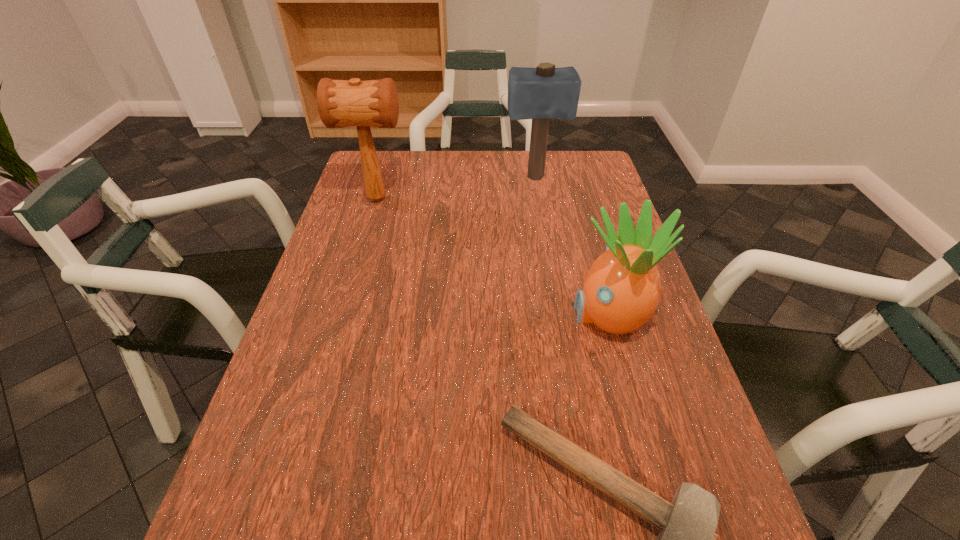
The width and height of the screenshot is (960, 540). I want to click on the leftmost object, so coord(341,103).

Where is `the second nearest object`? Image resolution: width=960 pixels, height=540 pixels. the second nearest object is located at coordinates (622, 289).

You are a GUI agent. You are given a task and a screenshot of the screen. Output one action in this format:
    pyautogui.click(x=<x>, y=<y>)
    Task: Click on the third tallest object
    The height and width of the screenshot is (540, 960).
    Given the screenshot: What is the action you would take?
    pyautogui.click(x=622, y=289)

You are a GUI agent. You are given a task and a screenshot of the screen. Output one action in this format:
    pyautogui.click(x=<x>, y=<y>)
    Task: Click on the free space located on the strike surface of the leftmost mallet
    The width and height of the screenshot is (960, 540).
    Given the screenshot: What is the action you would take?
    pyautogui.click(x=426, y=199)

I want to click on free space located at the entrance of the third tallest object, so click(473, 314).

Find the location of a particular element. free region located 0.070m at the entrance of the third tallest object is located at coordinates (539, 314).

At what (x,y) coordinates should I click in order to perform the action: click on free space located 0.160m at the entrance of the third tallest object. Please return your answer as a coordinate pair (x, y). This screenshot has height=540, width=960. Looking at the image, I should click on (499, 314).

Find the location of `object situated at the left edge`. object situated at the left edge is located at coordinates 341,103.

Identify the location of mallet that is at the right edge. Image resolution: width=960 pixels, height=540 pixels. (544, 92).

You are a GUI agent. You are given a task and a screenshot of the screen. Output one action in this format:
    pyautogui.click(x=<x>, y=<y>)
    Task: Click on the pineapple that is at the right edge
    
    Given the screenshot: What is the action you would take?
    pyautogui.click(x=622, y=289)